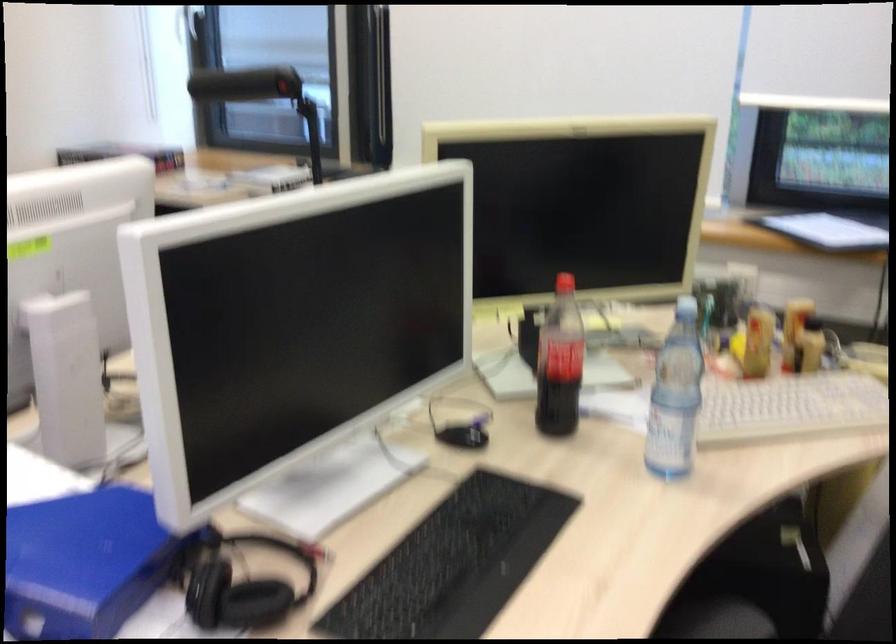
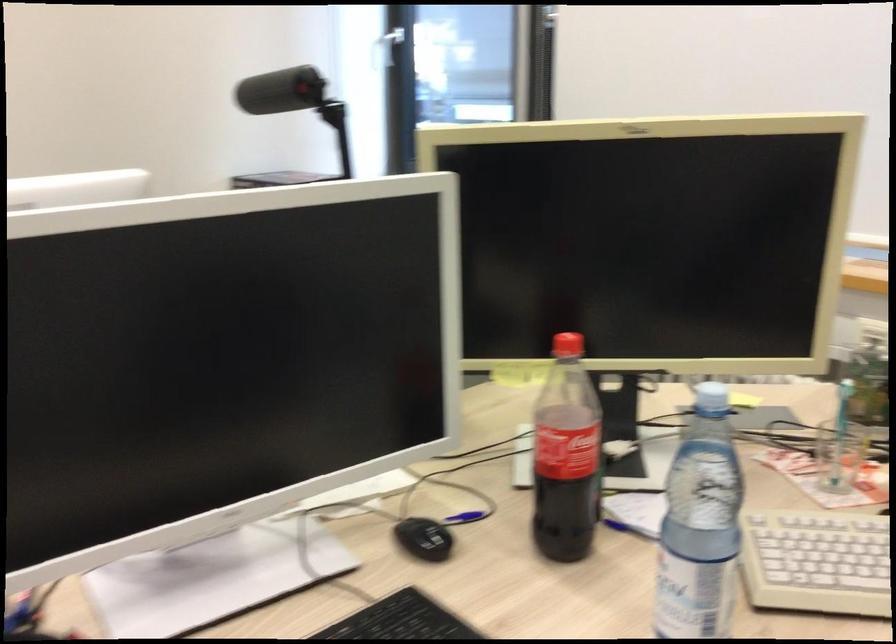
The point at [713,412] is marked in the first image. Where is the corresponding point in the second image?

(815, 562)